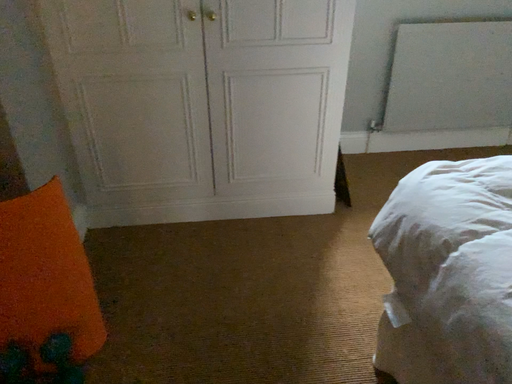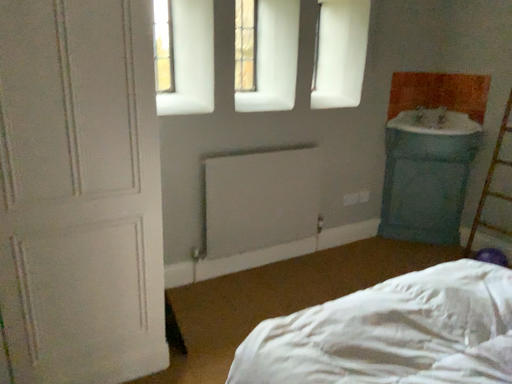
Question: Which way did the camera rotate in the video?

Choices:
 (A) rotated right
 (B) rotated left

Answer: (A)